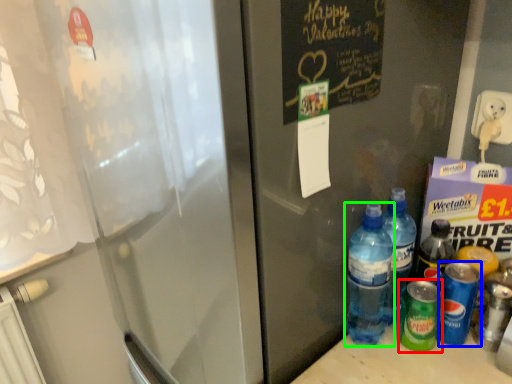
Question: Estimate the real-world distances between objects in this image. Which object is farther from bottle (highlighted by a red box), bottle (highlighted by a blue box) or bottle (highlighted by a green box)?

Choices:
 (A) bottle
 (B) bottle

Answer: (B)